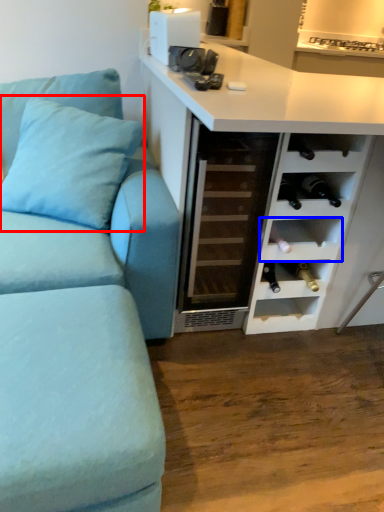
Question: Which point is closer to the camera, pillow (highlighted by a red box) or shelf (highlighted by a blue box)?

Choices:
 (A) pillow
 (B) shelf

Answer: (A)